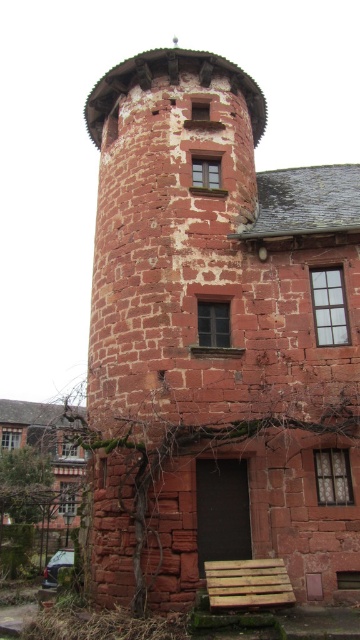
You are a delivery person trying to unload a package from a truck parked near the historic stone building. The wooden pallet at lower center is in your way. Can you move it aside to access the entrance without obstructing the red stone tower at center?

The wooden pallet at lower center can be moved aside since it is smaller than the red stone tower at center, allowing you to access the entrance without obstructing the tower.

You are an architect designing a new pathway that needs to be 2 meters wide. You observe the red stone tower at center and the wooden pallet at lower center in the image. Which object has a greater width, and will the pathway fit between them if placed adjacent to the wider one?

The red stone tower at center has a greater width than the wooden pallet at lower center. Since the pathway requires 2 meters, it can fit adjacent to the wider red stone tower at center if there is sufficient space, but the exact placement depends on the actual dimensions of the tower.